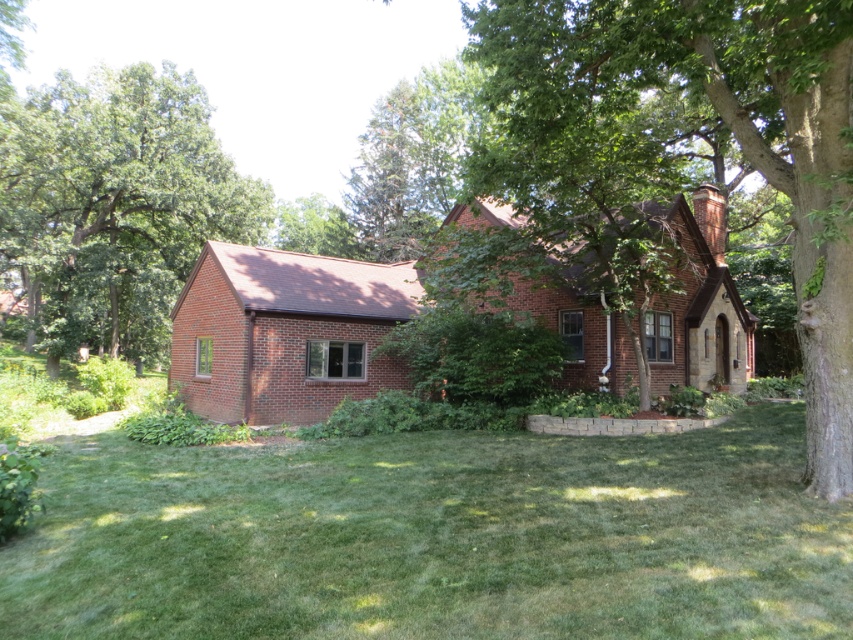
You are standing in front of the house and notice the green grass at lower center and the green leafy tree at left. Which object is closer to the ground?

The green grass at lower center is closer to the ground as it is located below the green leafy tree at left.

You are standing in front of the house and want to walk from the green leafy tree at left to the green leafy tree at center. Which direction should you move?

You should move to the right to go from the green leafy tree at left to the green leafy tree at center since the green leafy tree at center is to the right of the green leafy tree at left.